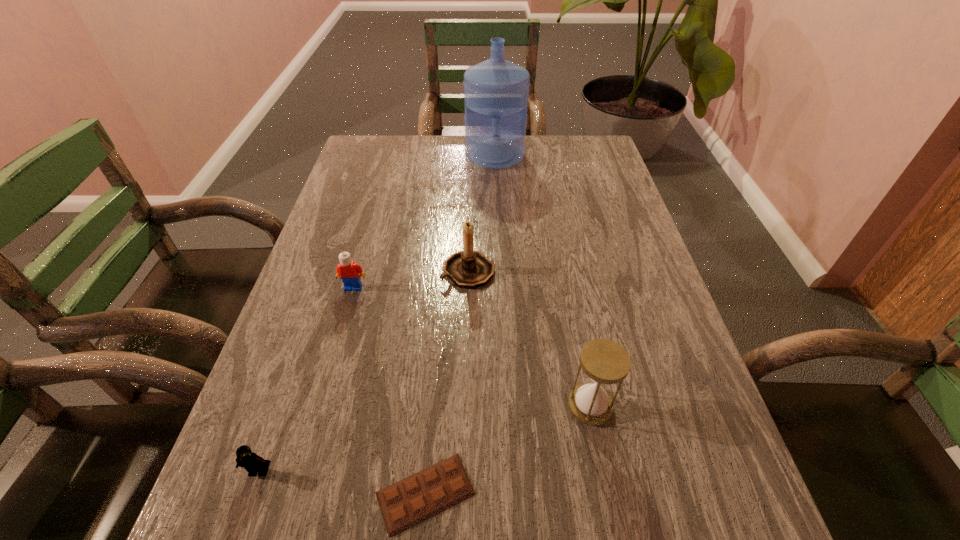
I want to click on vacant area that lies between the hourglass and the water jug, so click(x=542, y=280).

Where is `free space between the farther Lego and the candle holder`? free space between the farther Lego and the candle holder is located at coordinates (411, 279).

At what (x,y) coordinates should I click in order to perform the action: click on unoccupied area between the fourth tallest object and the shorter Lego. Please return your answer as a coordinate pair (x, y). This screenshot has height=540, width=960. Looking at the image, I should click on (306, 379).

Locate an element on the screen. object that is the closest to the farthest object is located at coordinates (470, 269).

Identify which object is the second closest to the left Lego. Please provide its 2D coordinates. Your answer should be formatted as a tuple, i.e. [(x, y)], where the tuple contains the x and y coordinates of a point satisfying the conditions above.

[(350, 273)]

Locate an element on the screen. free space in the image that satisfies the following two spatial constraints: 1. on the side of the hourglass with the handle; 2. on the left side of the farthest object is located at coordinates (507, 406).

Where is `vacant point that satisfies the following two spatial constraints: 1. on the side of the hourglass with the handle; 2. on the left side of the tallest object`? vacant point that satisfies the following two spatial constraints: 1. on the side of the hourglass with the handle; 2. on the left side of the tallest object is located at coordinates (507, 406).

What are the coordinates of `vacant region that satisfies the following two spatial constraints: 1. on the face of the farther Lego; 2. on the left side of the shortest object` in the screenshot? It's located at (296, 493).

Find the location of `free space that satisfies the following two spatial constraints: 1. on the face of the chocolate bar; 2. on the right side of the third shortest object`. free space that satisfies the following two spatial constraints: 1. on the face of the chocolate bar; 2. on the right side of the third shortest object is located at coordinates (296, 493).

Locate an element on the screen. Image resolution: width=960 pixels, height=540 pixels. free space that satisfies the following two spatial constraints: 1. on the face of the right Lego; 2. on the right side of the chocolate bar is located at coordinates 296,493.